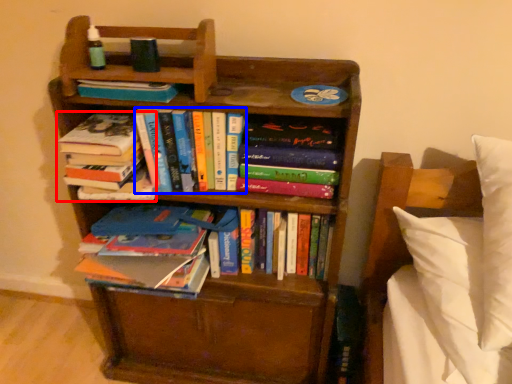
Question: Among these objects, which one is farthest to the camera, book (highlighted by a red box) or book (highlighted by a blue box)?

Choices:
 (A) book
 (B) book

Answer: (A)